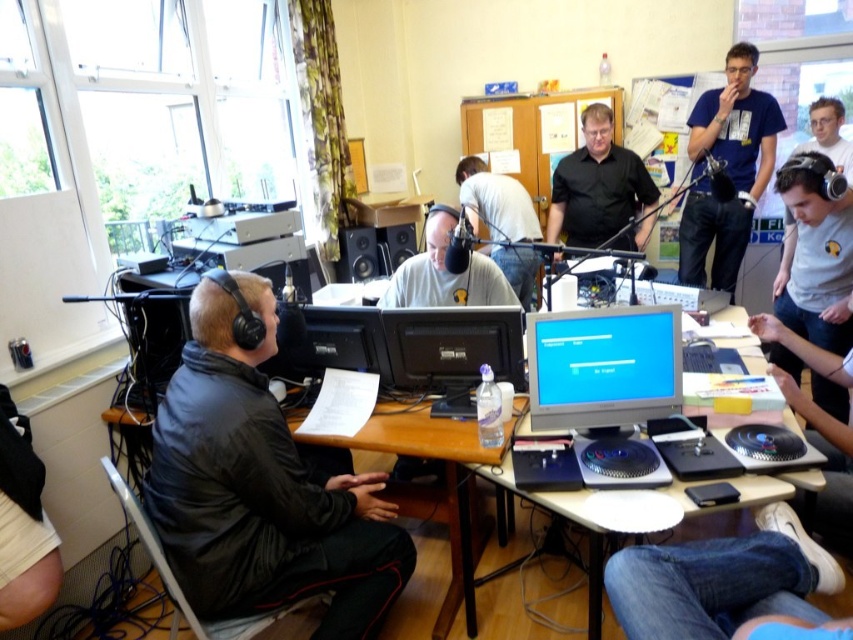
Is point (592, 385) positioned before point (518, 237)?

That is True.

Can you confirm if matte plastic monitor at center is positioned to the right of light gray shirt at center?

Correct, you'll find matte plastic monitor at center to the right of light gray shirt at center.

Locate an element on the screen. The height and width of the screenshot is (640, 853). matte plastic monitor at center is located at coordinates (602, 365).

Locate an element on the screen. The width and height of the screenshot is (853, 640). matte plastic monitor at center is located at coordinates [x=602, y=365].

Can you confirm if black matte shirt at center is smaller than matte black monitor at center?

Yes, black matte shirt at center is smaller than matte black monitor at center.

Can you confirm if black matte shirt at center is thinner than matte black monitor at center?

Yes.

Is point (561, 164) positioned before point (814, 474)?

No.

You are a GUI agent. You are given a task and a screenshot of the screen. Output one action in this format:
    pyautogui.click(x=<x>, y=<y>)
    Task: Click on the black matte shirt at center
    This screenshot has height=640, width=853.
    Given the screenshot: What is the action you would take?
    pyautogui.click(x=601, y=189)

Which is in front, point (596, 356) or point (494, 291)?

Point (596, 356)

Where is `matte plastic monitor at center`? matte plastic monitor at center is located at coordinates (602, 365).

Locate an element on the screen. The image size is (853, 640). matte plastic monitor at center is located at coordinates (602, 365).